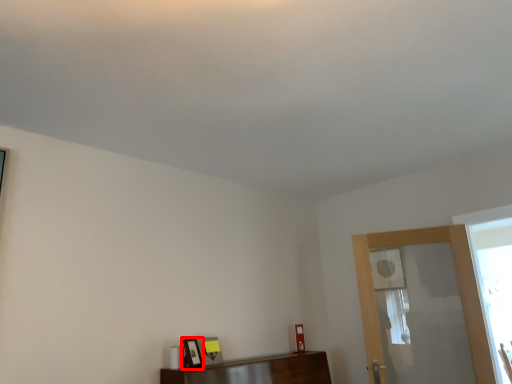
Question: From the image's perspective, where is picture frame (annotated by the red box) located relative to screen door?

Choices:
 (A) above
 (B) below

Answer: (B)